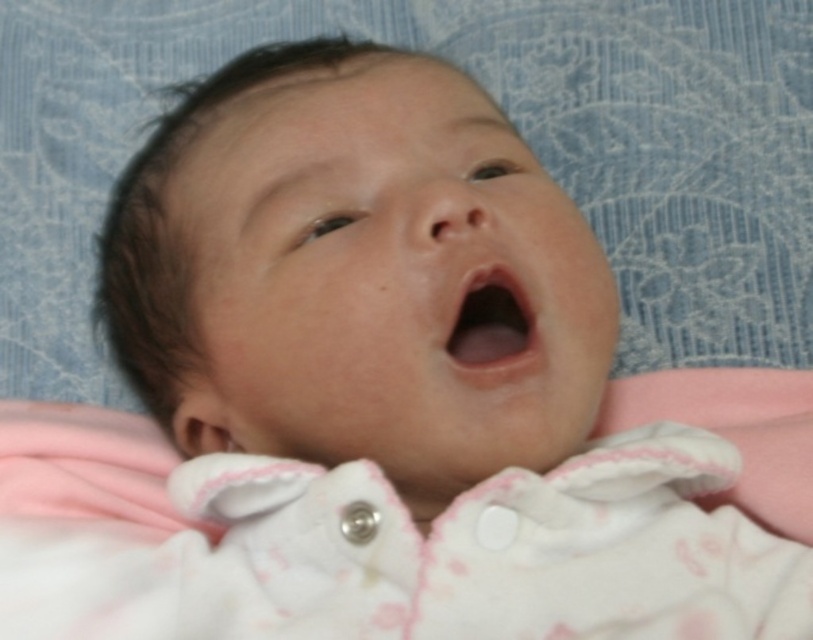
You are a photographer adjusting the focus on your camera. You want to capture the pink fabric at center and the pink smooth skin at center in the image. Which object should you focus on first to ensure it appears sharp in the final photo?

You should focus on the pink fabric at center first because it is closer to the viewer than the pink smooth skin at center, so adjusting focus starting from the closer object ensures both can be in focus if needed.

Looking at this image, based on the scene description, which object is positioned higher in the image, the pink fabric at center or the pink smooth skin at center?

The pink fabric at center is taller than the pink smooth skin at center according to the description.